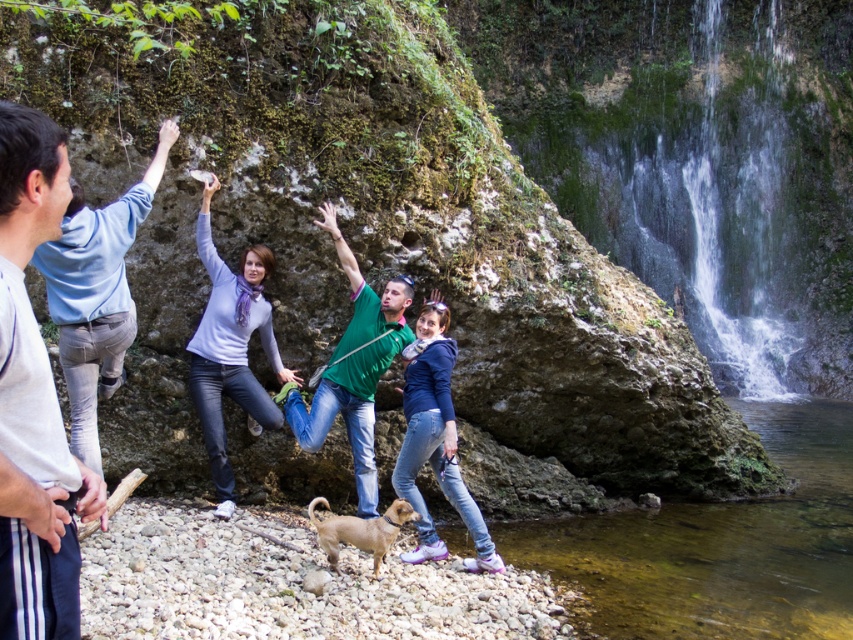
Who is taller, clear water at creek right or light blue jeans at left?

With more height is light blue jeans at left.

Based on the photo, which is more to the left, clear water at creek right or light blue jeans at left?

Positioned to the left is light blue jeans at left.

You are a GUI agent. You are given a task and a screenshot of the screen. Output one action in this format:
    pyautogui.click(x=<x>, y=<y>)
    Task: Click on the clear water at creek right
    
    Given the screenshot: What is the action you would take?
    pyautogui.click(x=718, y=545)

You are a GUI agent. You are given a task and a screenshot of the screen. Output one action in this format:
    pyautogui.click(x=<x>, y=<y>)
    Task: Click on the clear water at creek right
    This screenshot has width=853, height=640.
    Given the screenshot: What is the action you would take?
    pyautogui.click(x=718, y=545)

Is point (776, 566) farther from camera compared to point (228, 515)?

Yes, point (776, 566) is farther from viewer.

Is clear water at creek right wider than matte purple sweater at center?

Indeed, clear water at creek right has a greater width compared to matte purple sweater at center.

Locate an element on the screen. The width and height of the screenshot is (853, 640). clear water at creek right is located at coordinates (718, 545).

Is point (126, 326) positioned behind point (334, 531)?

Yes, it is behind point (334, 531).

In the scene shown: Does blue jeans at left have a lesser width compared to brown furry dog at lower center?

Incorrect, blue jeans at left's width is not less than brown furry dog at lower center's.

You are a GUI agent. You are given a task and a screenshot of the screen. Output one action in this format:
    pyautogui.click(x=<x>, y=<y>)
    Task: Click on the blue jeans at left
    The height and width of the screenshot is (640, 853).
    Given the screenshot: What is the action you would take?
    pyautogui.click(x=96, y=294)

The width and height of the screenshot is (853, 640). Find the location of `blue jeans at left`. blue jeans at left is located at coordinates (96, 294).